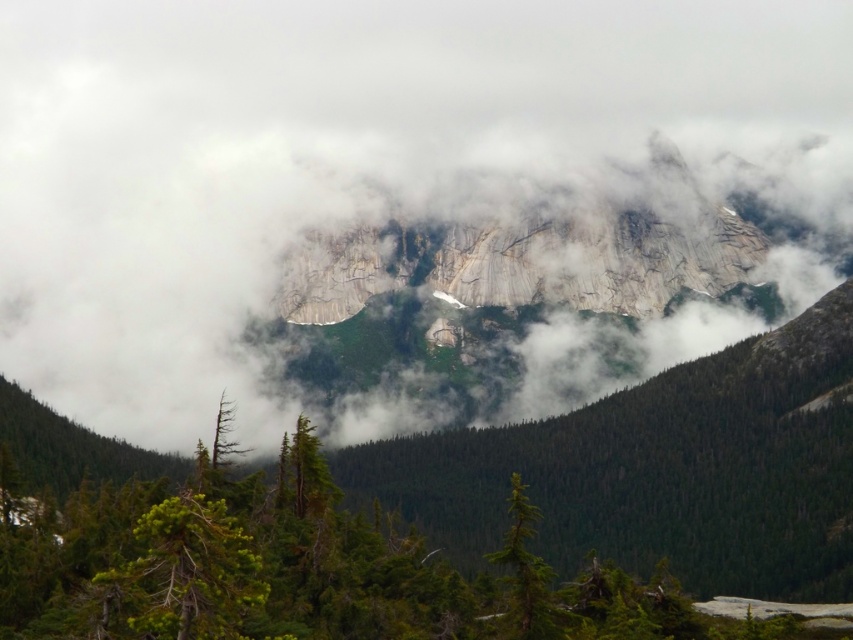
Between green matte tree at lower right and needle-like evergreen at lower left, which one has more height?

green matte tree at lower right

Looking at this image, between green matte tree at lower right and needle-like evergreen at lower left, which one is positioned higher?

needle-like evergreen at lower left is above.

Is point (523, 586) more distant than point (224, 396)?

No, (523, 586) is closer to viewer.

Where is `green matte tree at lower right`? This screenshot has height=640, width=853. green matte tree at lower right is located at coordinates (526, 572).

Can you confirm if white fluffy cloud at center is shorter than green matte tree at lower left?

Incorrect, white fluffy cloud at center's height does not fall short of green matte tree at lower left's.

Locate an element on the screen. The image size is (853, 640). white fluffy cloud at center is located at coordinates (347, 157).

Does green matte tree at lower left have a greater height compared to green matte tree at lower right?

In fact, green matte tree at lower left may be shorter than green matte tree at lower right.

Can you confirm if green matte tree at lower left is positioned to the left of green matte tree at lower right?

Yes, green matte tree at lower left is to the left of green matte tree at lower right.

Which is behind, point (132, 593) or point (538, 577)?

The point (538, 577) is more distant.

You are a GUI agent. You are given a task and a screenshot of the screen. Output one action in this format:
    pyautogui.click(x=<x>, y=<y>)
    Task: Click on the green matte tree at lower left
    The image size is (853, 640).
    Given the screenshot: What is the action you would take?
    pyautogui.click(x=183, y=573)